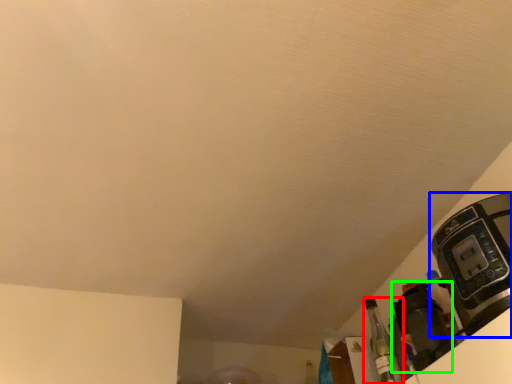
Question: Based on their relative distances, which object is nearer to bottle (highlighted by a red box)? Choose from coffee machine (highlighted by a blue box) and appliance (highlighted by a green box).

Choices:
 (A) coffee machine
 (B) appliance

Answer: (B)